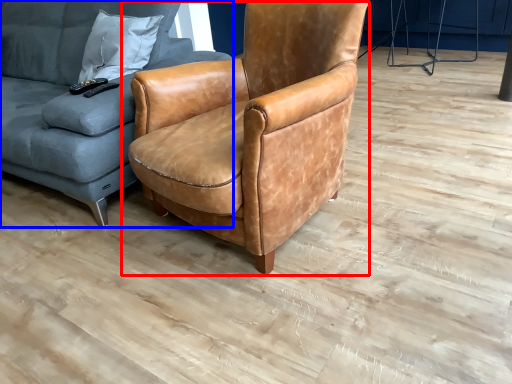
Question: Which object is closer to the camera taking this photo, chair (highlighted by a red box) or studio couch (highlighted by a blue box)?

Choices:
 (A) chair
 (B) studio couch

Answer: (A)